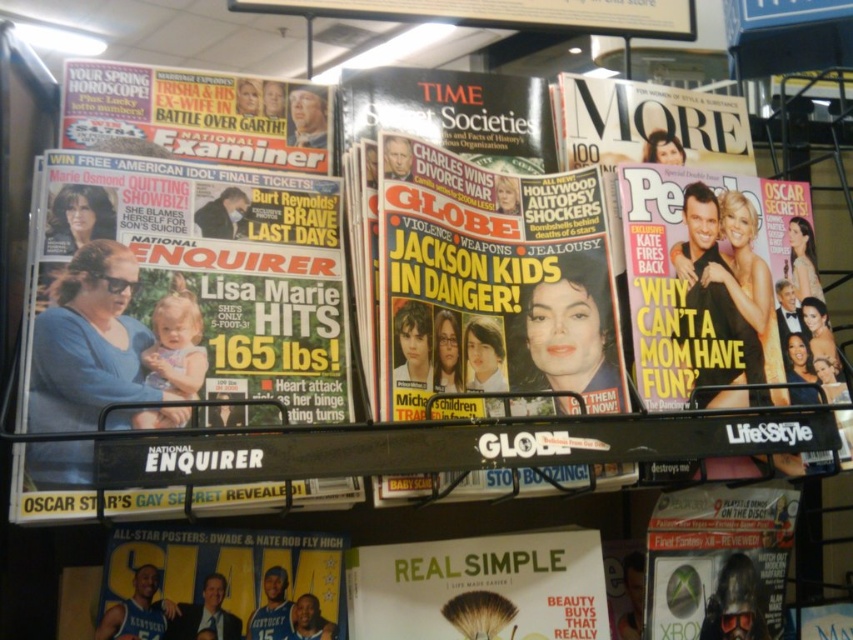
Question: In this image, where is blue fabric poster at lower center located relative to matte white magazine at center?

Choices:
 (A) left
 (B) right

Answer: (A)

Question: Does blue fabric poster at lower center come behind matte white magazine at center?

Choices:
 (A) yes
 (B) no

Answer: (B)

Question: Is the position of blue fabric poster at lower center more distant than that of matte white magazine at center?

Choices:
 (A) yes
 (B) no

Answer: (B)

Question: Among these points, which one is farthest from the camera?

Choices:
 (A) (140, 534)
 (B) (485, 554)

Answer: (B)

Question: Which point is farther to the camera?

Choices:
 (A) blue fabric poster at lower center
 (B) matte white magazine at center

Answer: (B)